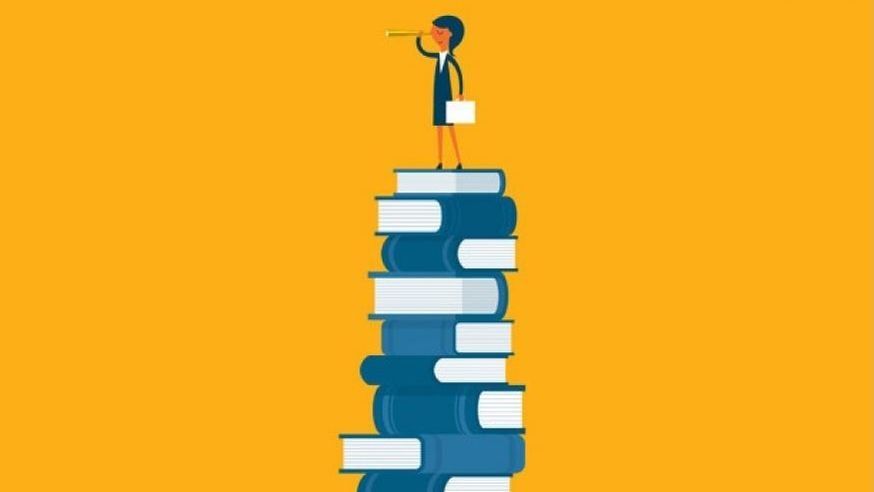
Identify the location of horizontal books. (391, 481), (401, 446), (424, 401), (420, 372), (420, 340), (412, 300), (422, 259), (422, 224), (406, 173).